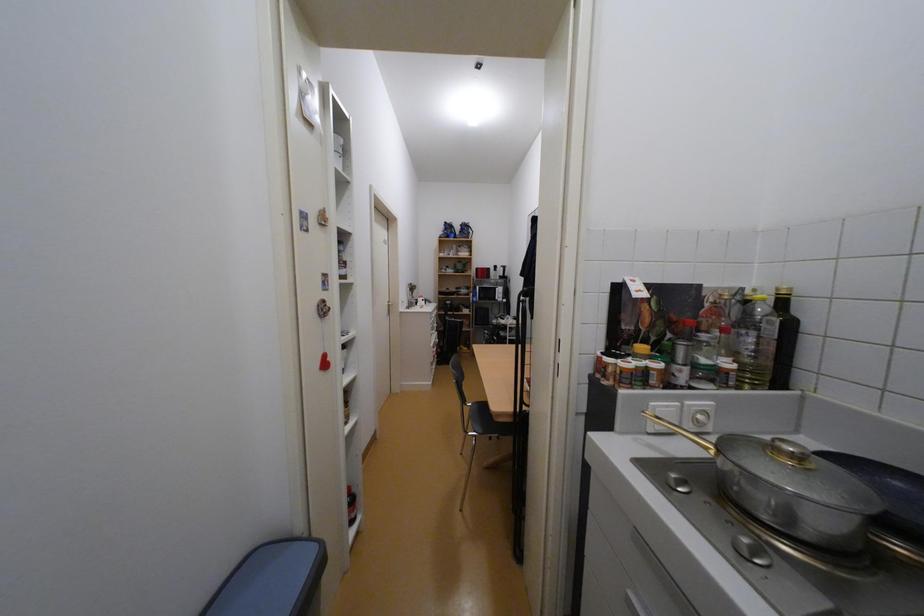
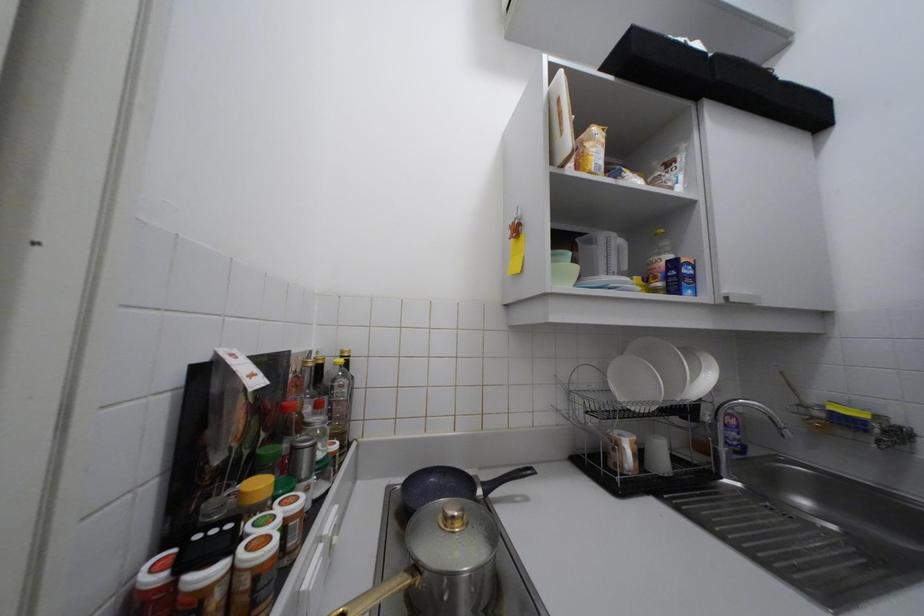
Question: The camera is either moving clockwise (left) or counter-clockwise (right) around the object. The first image is from the beginning of the video and the second image is from the end. Is the camera moving left or right when shooting the video?

Choices:
 (A) Left
 (B) Right

Answer: (A)